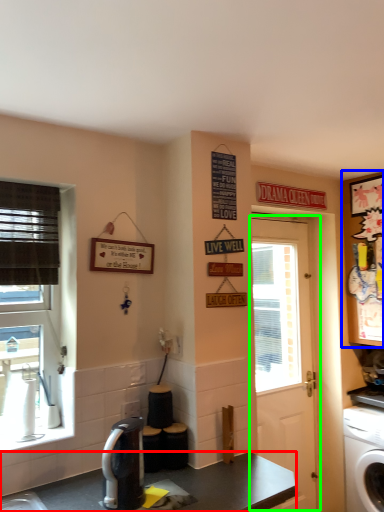
Question: Which object is positioned farthest from desk (highlighted by a red box)? Select from cabinetry (highlighted by a blue box) and door (highlighted by a green box).

Choices:
 (A) cabinetry
 (B) door

Answer: (A)